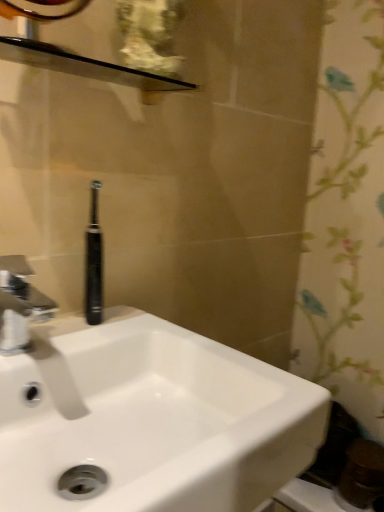
Question: From a real-world perspective, is silver metallic faucet at left physically located above or below white glossy sink at center?

Choices:
 (A) above
 (B) below

Answer: (A)

Question: Does point click(x=6, y=306) appear closer or farther from the camera than point click(x=246, y=459)?

Choices:
 (A) closer
 (B) farther

Answer: (B)

Question: Based on their relative distances, which object is nearer to the white glossy sink at center?

Choices:
 (A) black glossy balustrade at upper center
 (B) silver metallic faucet at left
 (C) black rubber toothbrush at center

Answer: (B)

Question: Which of these objects is positioned farthest from the white glossy sink at center?

Choices:
 (A) silver metallic faucet at left
 (B) black rubber toothbrush at center
 (C) black glossy balustrade at upper center

Answer: (C)